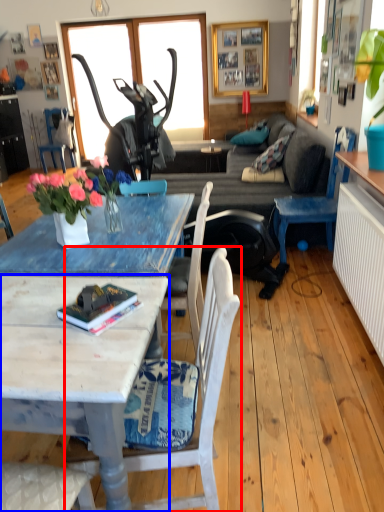
Question: Which point is further to the camera, chair (highlighted by a red box) or coffee table (highlighted by a blue box)?

Choices:
 (A) chair
 (B) coffee table

Answer: (A)